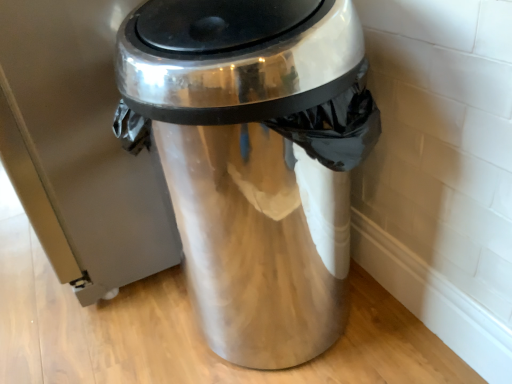
What do you see at coordinates (254, 159) in the screenshot? I see `polished stainless steel trash can at center` at bounding box center [254, 159].

Identify the location of polished stainless steel trash can at center. (254, 159).

Locate an element on the screen. The width and height of the screenshot is (512, 384). polished stainless steel trash can at center is located at coordinates (254, 159).